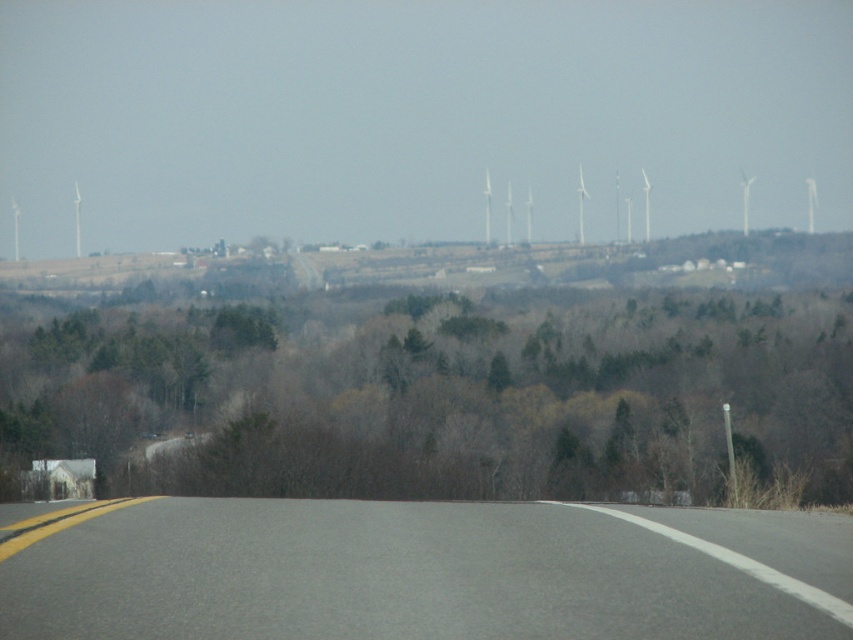
You are standing at the starting point of the road in the rural landscape. There are two points marked on the road ahead of you. One is at coordinates point (265, 484) and the other at point (74, 188). Which point is nearer to your current position?

Point (265, 484) is closer to the camera than point (74, 188), so the point at coordinates point (265, 484) is nearer to your current position.